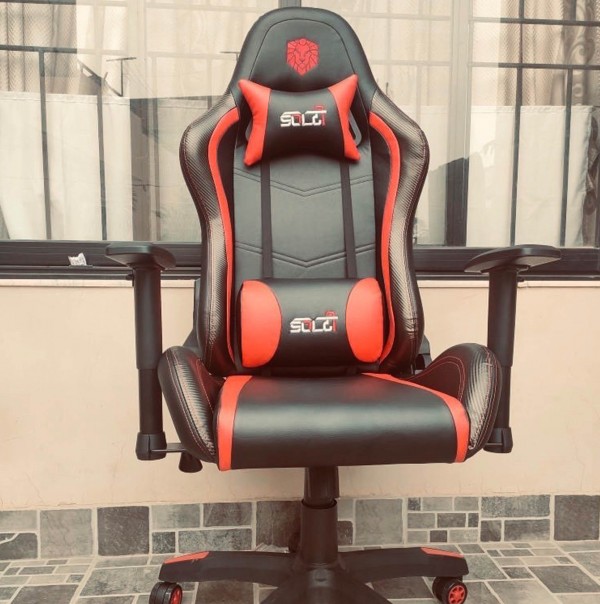
The height and width of the screenshot is (604, 600). In order to click on wall in this screenshot , I will do (x=97, y=419).